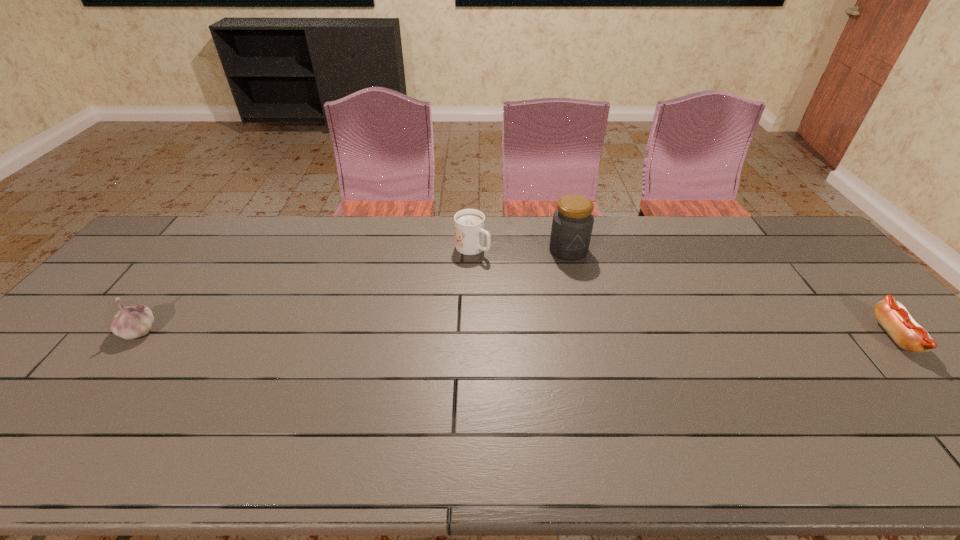
The width and height of the screenshot is (960, 540). I want to click on vacant space at the left edge of the desktop, so click(75, 349).

In the image, there is a desktop. Where is `free space at the right edge`? The width and height of the screenshot is (960, 540). free space at the right edge is located at coordinates (838, 284).

Find the location of a particular element. vacant area at the far left corner of the desktop is located at coordinates (x=193, y=227).

Locate an element on the screen. This screenshot has height=540, width=960. free region at the near right corner of the desktop is located at coordinates (914, 400).

Locate an element on the screen. The image size is (960, 540). free spot between the shortest object and the third object from right to left is located at coordinates (684, 292).

The height and width of the screenshot is (540, 960). What are the coordinates of `empty space between the third object from right to left and the leftmost object` in the screenshot? It's located at (306, 289).

The image size is (960, 540). I want to click on vacant area that lies between the second object from right to left and the cappuccino, so click(x=520, y=249).

Where is `vacant region between the shortest object and the cappuccino`? The image size is (960, 540). vacant region between the shortest object and the cappuccino is located at coordinates (684, 292).

Identify the location of free space between the cappuccino and the shortest object. (684, 292).

This screenshot has height=540, width=960. I want to click on free spot between the second object from right to left and the cappuccino, so click(520, 249).